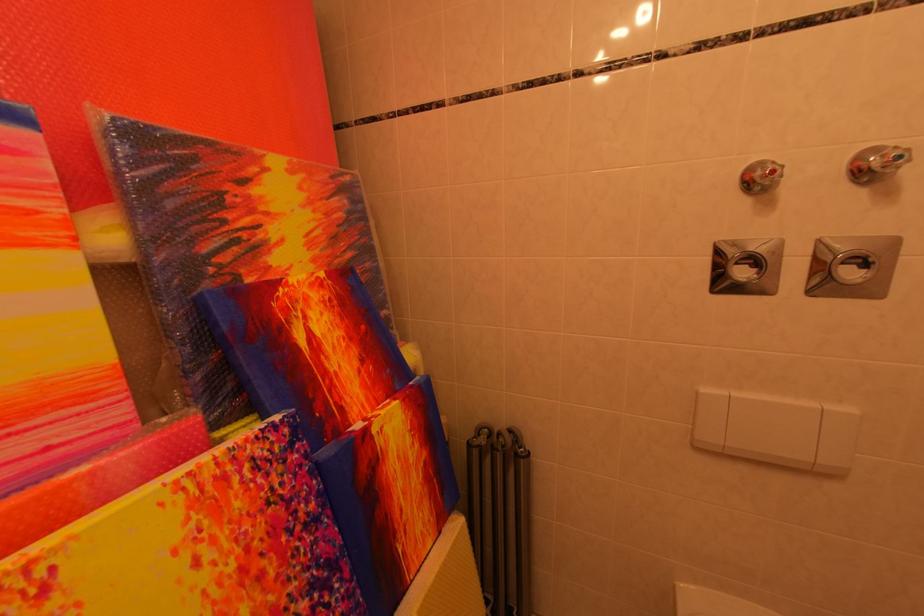
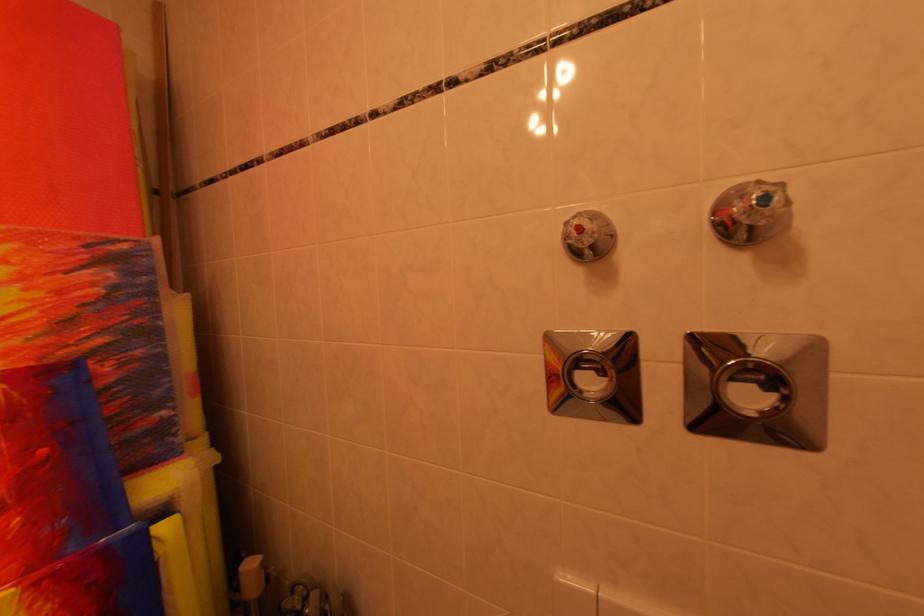
The images are taken continuously from a first-person perspective. In which direction are you moving?

The cameraman walked toward right, forward.